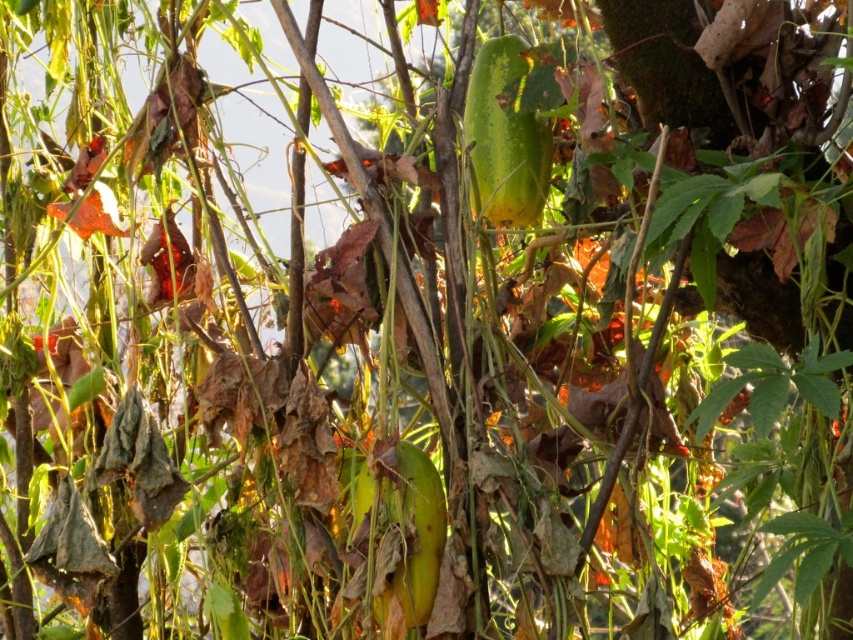
Question: Which object is farther from the camera taking this photo?

Choices:
 (A) green matte papaya at center
 (B) green matte pickle at center

Answer: (A)

Question: Is green matte papaya at center bigger than green matte pickle at center?

Choices:
 (A) yes
 (B) no

Answer: (B)

Question: Which point is closer to the camera taking this photo?

Choices:
 (A) tap(531, 141)
 (B) tap(424, 566)

Answer: (B)

Question: Does green matte papaya at center lie behind green matte pickle at center?

Choices:
 (A) yes
 (B) no

Answer: (A)

Question: Does green matte papaya at center appear under green matte pickle at center?

Choices:
 (A) no
 (B) yes

Answer: (A)